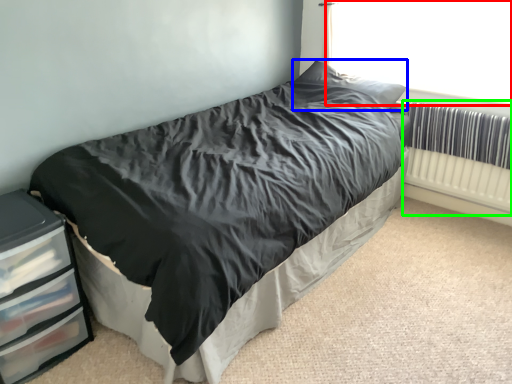
Question: Considering the real-world distances, which object is closest to window screen (highlighted by a red box)? pillow (highlighted by a blue box) or radiator (highlighted by a green box).

Choices:
 (A) pillow
 (B) radiator

Answer: (A)